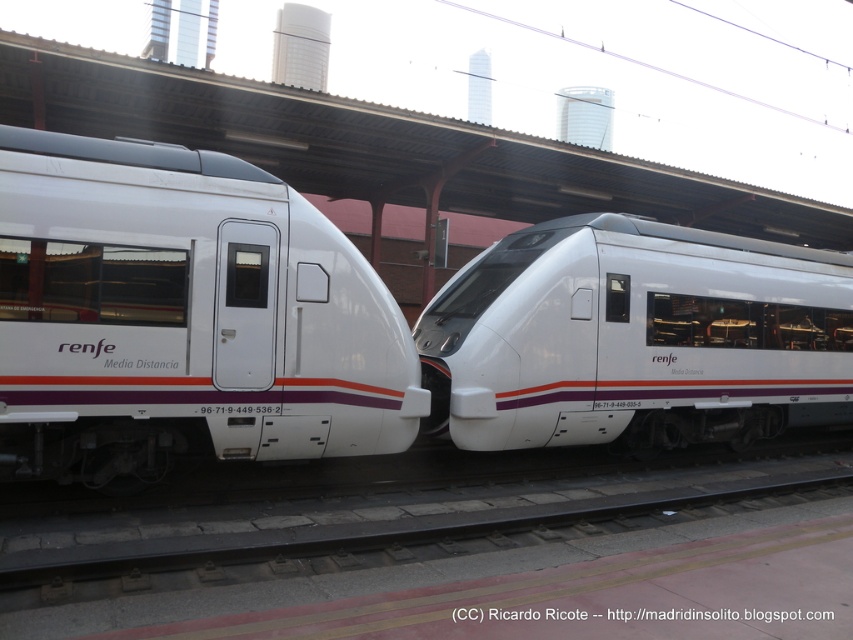
You are a passenger waiting at the station and want to board the taller train. Which train should you approach, the white glossy train at left or the white glossy train at center?

The white glossy train at center is taller than the white glossy train at left, so you should approach the white glossy train at center.

You are a passenger waiting on the platform and see the two white glossy trains. Which train, the white glossy train at left or the white glossy train at center, is closer to you?

The white glossy train at left is closer to you because it is in front of the white glossy train at center.